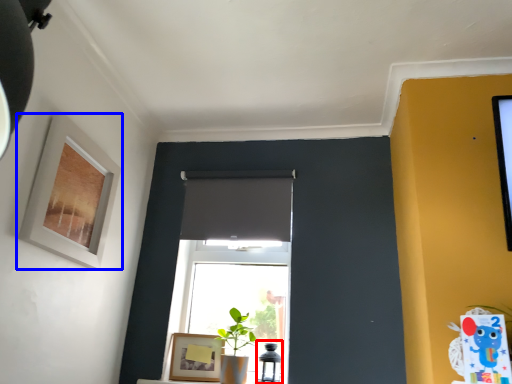
Question: Which of the following is the farthest to the observer, table lamp (highlighted by a red box) or picture frame (highlighted by a blue box)?

Choices:
 (A) table lamp
 (B) picture frame

Answer: (A)